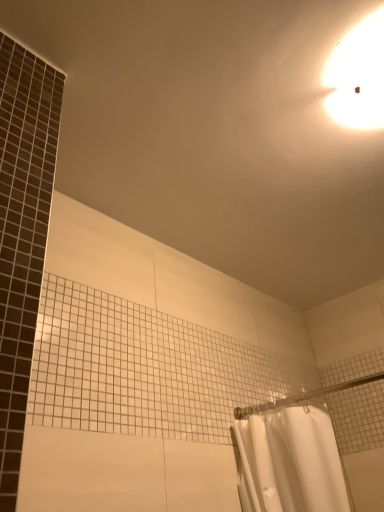
Where is `white glossy light at upper right`? white glossy light at upper right is located at coordinates (358, 76).

The width and height of the screenshot is (384, 512). Describe the element at coordinates (358, 76) in the screenshot. I see `white glossy light at upper right` at that location.

Find the location of a particular element. This screenshot has width=384, height=512. white glossy light at upper right is located at coordinates (358, 76).